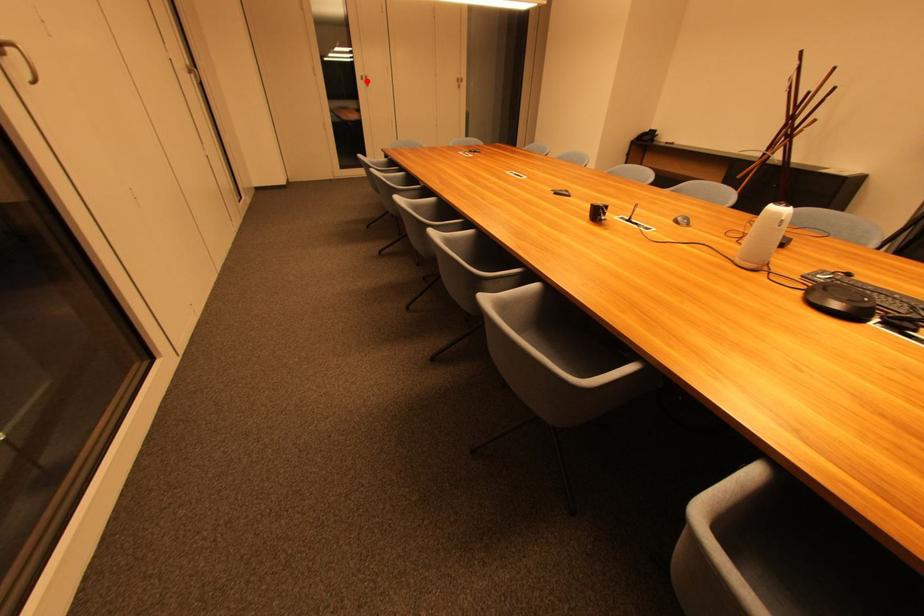
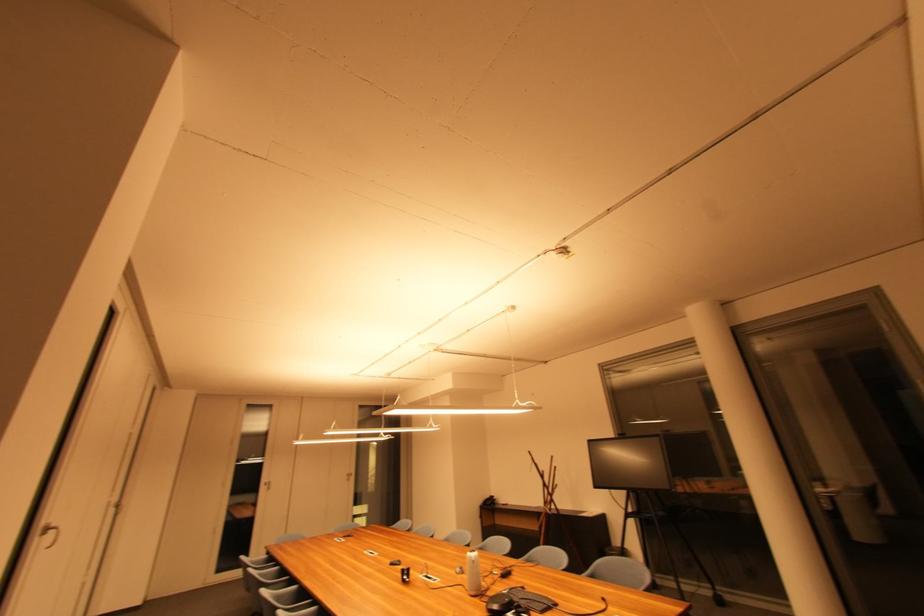
Locate, in the second image, the point that corresponds to the highlighted location in the first image.

(271, 485)